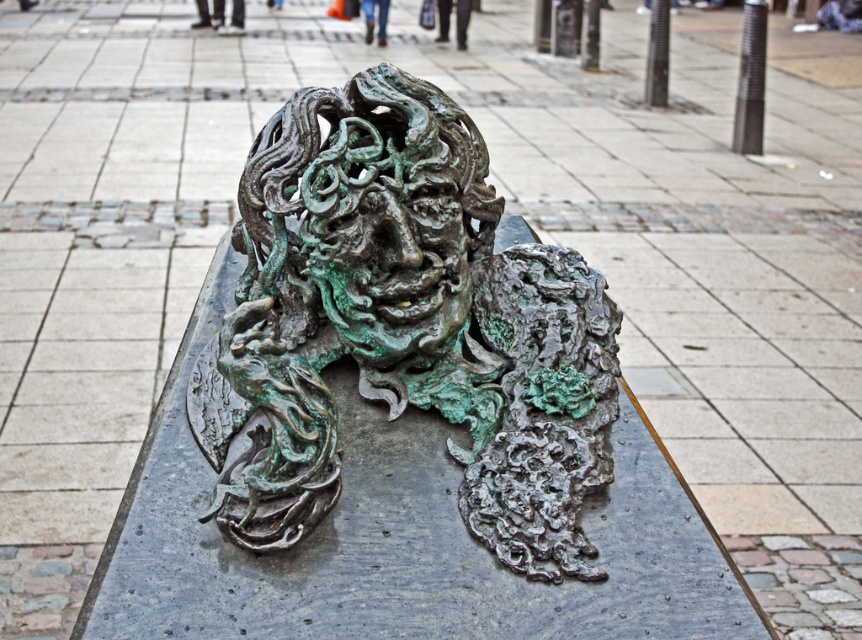
Based on the coordinates provided in the description, where is the green patina bronze sculpture at center located in the image?

The green patina bronze sculpture at center is located at point coordinates of (403, 328).

You are an art conservator assessing the sculpture. You need to determine if the green patina bronze sculpture at center can be moved without dislodging the green patina bronze face at center. Based on their sizes, which one is larger?

The green patina bronze sculpture at center is bigger than the green patina bronze face at center, so the sculpture is larger and would require careful handling to avoid affecting the face.

You are an art conservator assessing the placement of the green patina bronze sculpture at center and the green patina bronze face at center on the bench. Which object has a greater width?

The green patina bronze sculpture at center might be wider than the green patina bronze face at center according to the description.